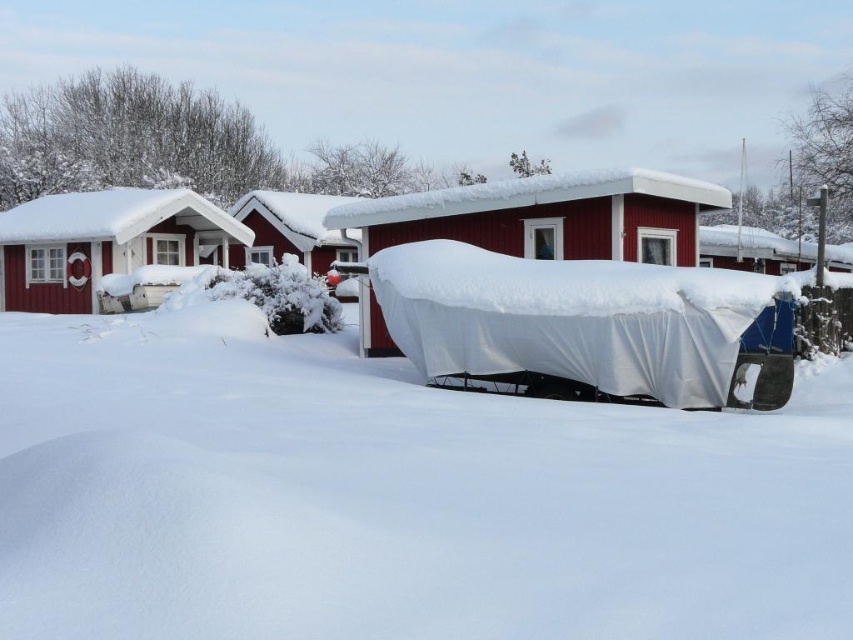
Question: Which point appears closest to the camera in this image?

Choices:
 (A) (457, 208)
 (B) (700, 253)

Answer: (A)

Question: Does matte red boat at center have a larger size compared to white plastic boat at right?

Choices:
 (A) yes
 (B) no

Answer: (B)

Question: Among these objects, which one is farthest from the camera?

Choices:
 (A) matte red wooden hut at left
 (B) white plastic boat at right

Answer: (A)

Question: Does matte red wooden hut at left appear on the left side of white plastic boat at right?

Choices:
 (A) yes
 (B) no

Answer: (A)

Question: Which point appears farthest from the camera in this image?

Choices:
 (A) (91, 284)
 (B) (776, 257)

Answer: (B)

Question: Is matte red boat at center below white plastic boat at right?

Choices:
 (A) yes
 (B) no

Answer: (A)